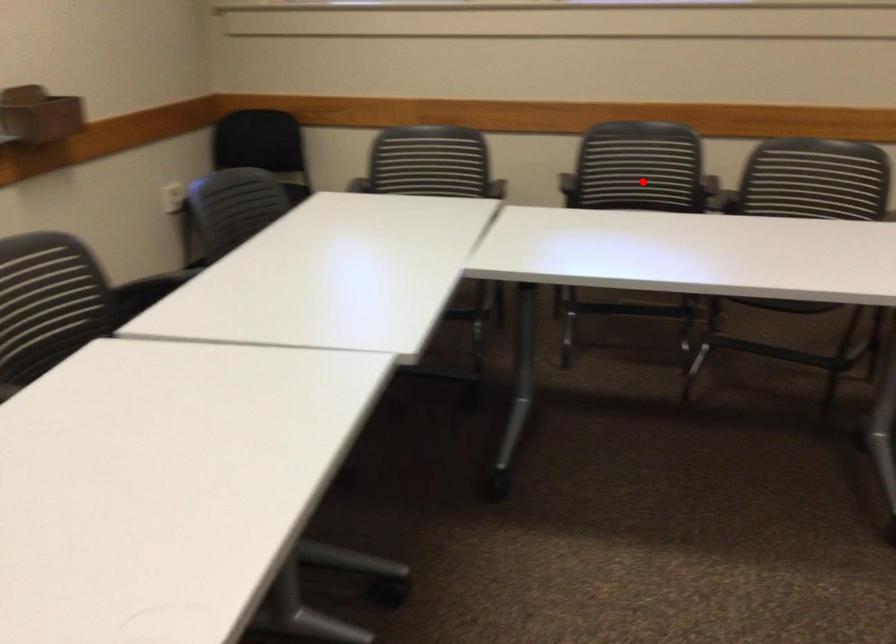
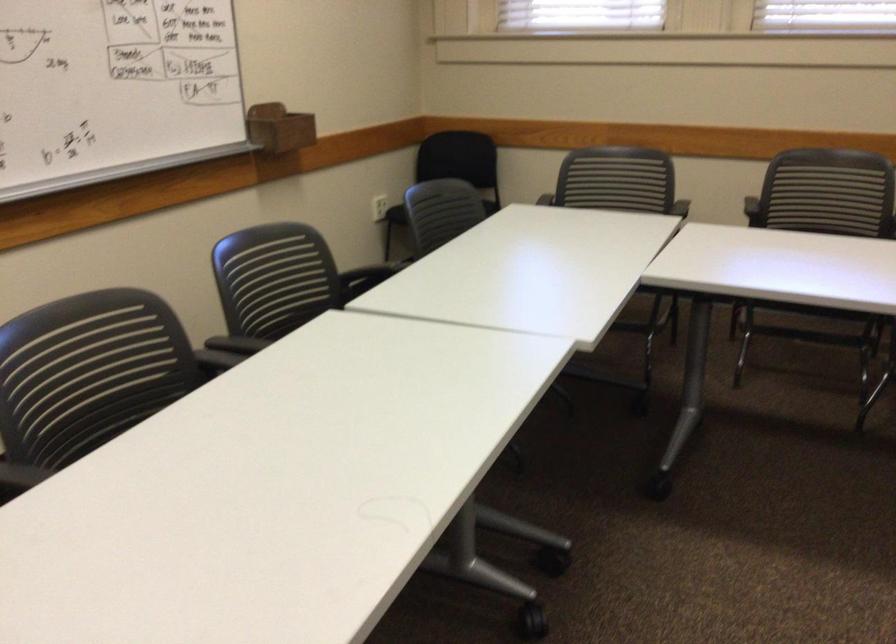
Locate, in the second image, the point that corresponds to the highlighted location in the first image.

(828, 200)